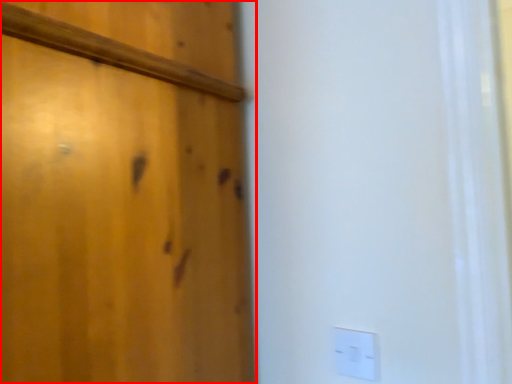
Question: From the image's perspective, what is the correct spatial positioning of door (annotated by the red box) in reference to light switch?

Choices:
 (A) above
 (B) below

Answer: (A)